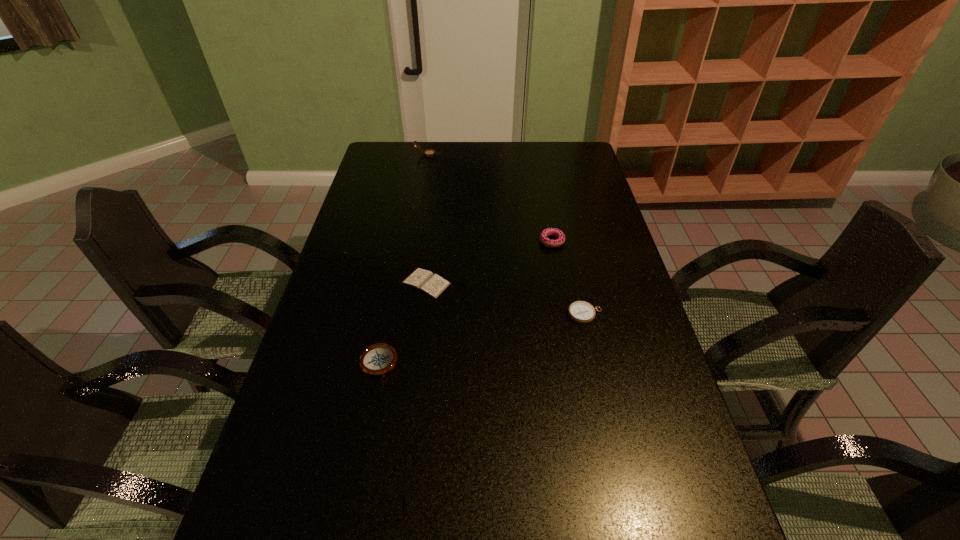
You are a GUI agent. You are given a task and a screenshot of the screen. Output one action in this format:
    pyautogui.click(x=<x>, y=<y>)
    Task: Click on the free space at the right edge
    The height and width of the screenshot is (540, 960).
    Given the screenshot: What is the action you would take?
    pyautogui.click(x=608, y=328)

Where is `vacant space at the far left corner of the desktop`? This screenshot has height=540, width=960. vacant space at the far left corner of the desktop is located at coordinates (382, 163).

Find the location of a particular element. Image resolution: width=960 pixels, height=540 pixels. free region at the far right corner of the desktop is located at coordinates (575, 143).

Where is `vacant space that's between the tallest compass and the doughnut`? vacant space that's between the tallest compass and the doughnut is located at coordinates (490, 198).

Locate an element on the screen. free space between the shortest object and the second nearest compass is located at coordinates 506,299.

Locate an element on the screen. The width and height of the screenshot is (960, 540). free spot between the third shortest object and the third nearest object is located at coordinates (402, 323).

The image size is (960, 540). In order to click on blank region between the second nearest compass and the fourth nearest object in this screenshot , I will do `click(568, 278)`.

In order to click on vacant region between the second tallest compass and the second nearest object in this screenshot , I will do `click(482, 339)`.

Locate an element on the screen. This screenshot has height=540, width=960. empty space that is in between the second nearest compass and the shortest object is located at coordinates (506, 299).

Locate an element on the screen. vacant region between the second tallest compass and the tallest compass is located at coordinates (403, 259).